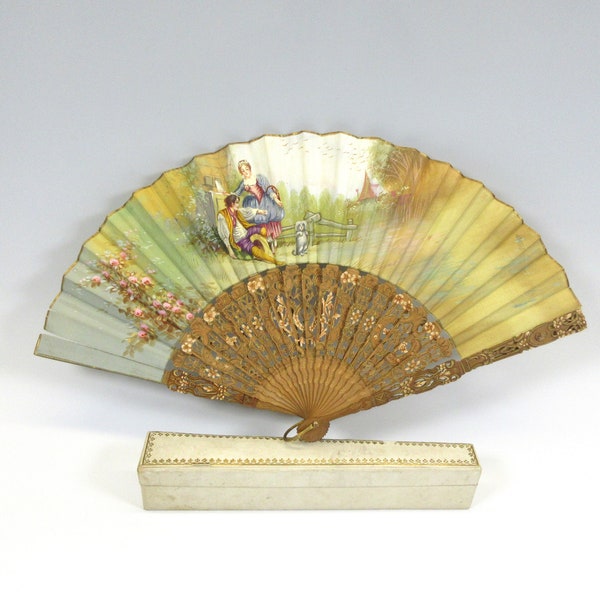
Identify the location of victorian young lady artwork. The image size is (600, 600). (245, 168), (261, 182), (259, 199), (276, 213), (273, 234), (274, 243), (238, 192), (248, 202).